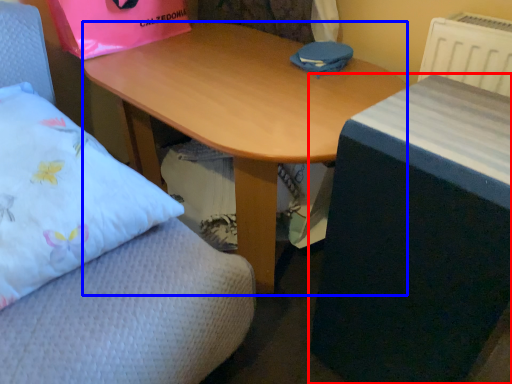
Question: Which of the following is the closest to the observer, table (highlighted by a red box) or desk (highlighted by a blue box)?

Choices:
 (A) table
 (B) desk

Answer: (A)